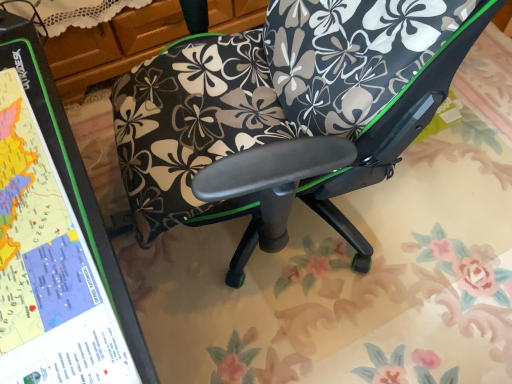
Question: Considering the positions of green matte map at left and floral-patterned fabric chair at center in the image, is green matte map at left wider or thinner than floral-patterned fabric chair at center?

Choices:
 (A) wide
 (B) thin

Answer: (B)

Question: Is green matte map at left taller or shorter than floral-patterned fabric chair at center?

Choices:
 (A) short
 (B) tall

Answer: (A)

Question: Is green matte map at left in front of or behind floral-patterned fabric chair at center in the image?

Choices:
 (A) front
 (B) behind

Answer: (A)

Question: Choose the correct answer: Is floral-patterned fabric chair at center inside green matte map at left or outside it?

Choices:
 (A) inside
 (B) outside

Answer: (B)

Question: Would you say floral-patterned fabric chair at center is to the left or to the right of green matte map at left in the picture?

Choices:
 (A) right
 (B) left

Answer: (A)

Question: Considering the positions of floral-patterned fabric chair at center and green matte map at left in the image, is floral-patterned fabric chair at center wider or thinner than green matte map at left?

Choices:
 (A) thin
 (B) wide

Answer: (B)

Question: Considering the positions of point (245, 127) and point (14, 357), is point (245, 127) closer or farther from the camera than point (14, 357)?

Choices:
 (A) closer
 (B) farther

Answer: (B)